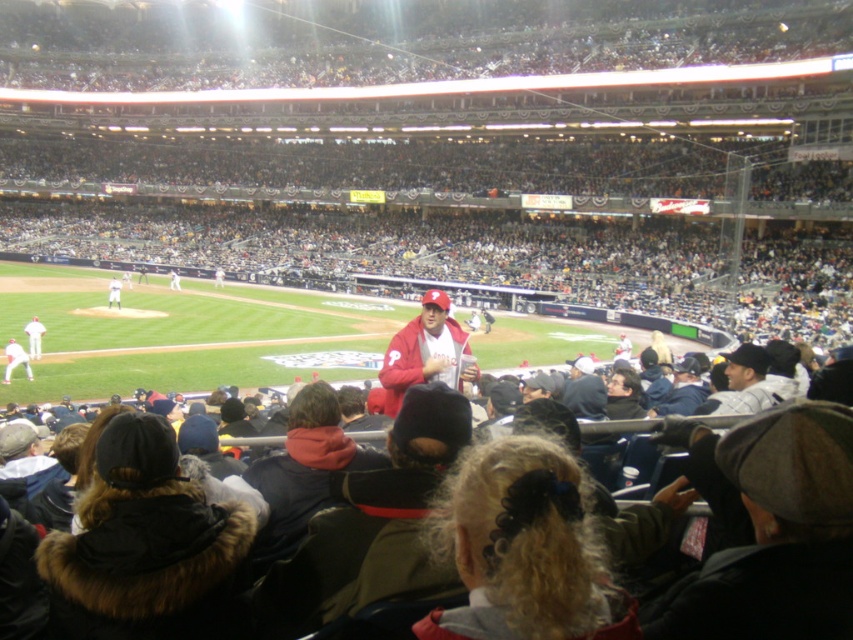
Question: Among these points, which one is nearest to the camera?

Choices:
 (A) (28, 339)
 (B) (682, 403)
 (C) (405, 384)

Answer: (B)

Question: Which of the following is the farthest from the observer?

Choices:
 (A) white jersey at right
 (B) matte red jacket at center

Answer: (B)

Question: Estimate the real-world distances between objects in this image. Which object is farther from the matte white jersey at lower left?

Choices:
 (A) matte red jacket at center
 (B) white jersey at right

Answer: (B)

Question: Is matte red jacket at center positioned in front of dark blue jacket at center?

Choices:
 (A) yes
 (B) no

Answer: (B)

Question: Does matte red jacket at center have a smaller size compared to white jersey at center?

Choices:
 (A) yes
 (B) no

Answer: (B)

Question: In this image, where is dark blue jacket at center located relative to white jersey at center?

Choices:
 (A) below
 (B) above

Answer: (A)